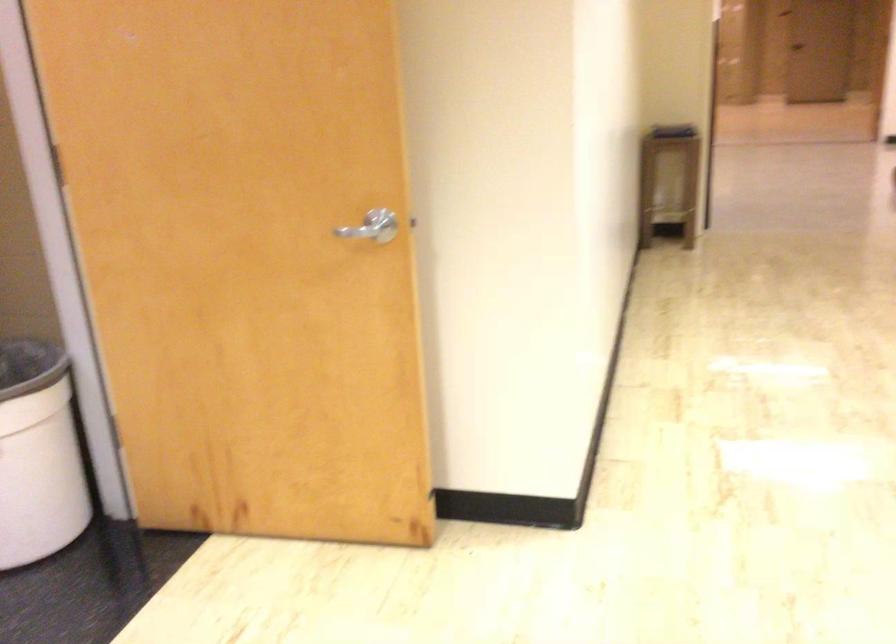
What are the coordinates of `silver door handle` in the screenshot? It's located at (366, 232).